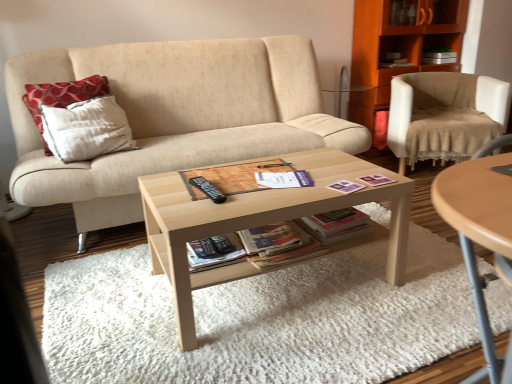
Question: Is light wood/texture coffee table at center not inside beige fabric couch at center?

Choices:
 (A) yes
 (B) no

Answer: (A)

Question: Is light wood/texture coffee table at center closer to camera compared to beige fabric couch at center?

Choices:
 (A) yes
 (B) no

Answer: (A)

Question: Is light wood/texture coffee table at center beside beige fabric couch at center?

Choices:
 (A) yes
 (B) no

Answer: (B)

Question: Would you consider light wood/texture coffee table at center to be distant from beige fabric couch at center?

Choices:
 (A) no
 (B) yes

Answer: (A)

Question: Considering the relative sizes of light wood/texture coffee table at center and beige fabric couch at center in the image provided, is light wood/texture coffee table at center taller than beige fabric couch at center?

Choices:
 (A) yes
 (B) no

Answer: (B)

Question: Considering the positions of light wood/texture coffee table at center and red dotted fabric pillow at left in the image, is light wood/texture coffee table at center wider or thinner than red dotted fabric pillow at left?

Choices:
 (A) wide
 (B) thin

Answer: (A)

Question: In the image, is light wood/texture coffee table at center positioned in front of or behind red dotted fabric pillow at left?

Choices:
 (A) front
 (B) behind

Answer: (A)

Question: Based on their sizes in the image, would you say light wood/texture coffee table at center is bigger or smaller than red dotted fabric pillow at left?

Choices:
 (A) small
 (B) big

Answer: (B)

Question: Considering the positions of point (173, 261) and point (24, 97), is point (173, 261) closer or farther from the camera than point (24, 97)?

Choices:
 (A) closer
 (B) farther

Answer: (A)

Question: In the image, is beige fabric chair at right positioned in front of or behind red dotted fabric pillow at left?

Choices:
 (A) behind
 (B) front

Answer: (A)

Question: From a real-world perspective, is beige fabric chair at right positioned above or below red dotted fabric pillow at left?

Choices:
 (A) above
 (B) below

Answer: (B)

Question: Considering the positions of beige fabric chair at right and red dotted fabric pillow at left in the image, is beige fabric chair at right taller or shorter than red dotted fabric pillow at left?

Choices:
 (A) short
 (B) tall

Answer: (B)

Question: In terms of size, does beige fabric chair at right appear bigger or smaller than red dotted fabric pillow at left?

Choices:
 (A) small
 (B) big

Answer: (B)

Question: Considering the positions of beige fabric chair at right and wooden cabinet at upper right in the image, is beige fabric chair at right wider or thinner than wooden cabinet at upper right?

Choices:
 (A) thin
 (B) wide

Answer: (B)

Question: Is point (489, 114) positioned closer to the camera than point (465, 3)?

Choices:
 (A) closer
 (B) farther

Answer: (A)